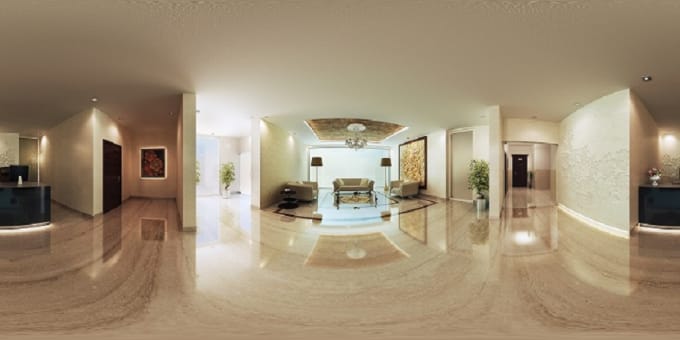
Find the location of a particular element. This screenshot has height=340, width=680. wall painting is located at coordinates pos(151,168), pos(413,158).